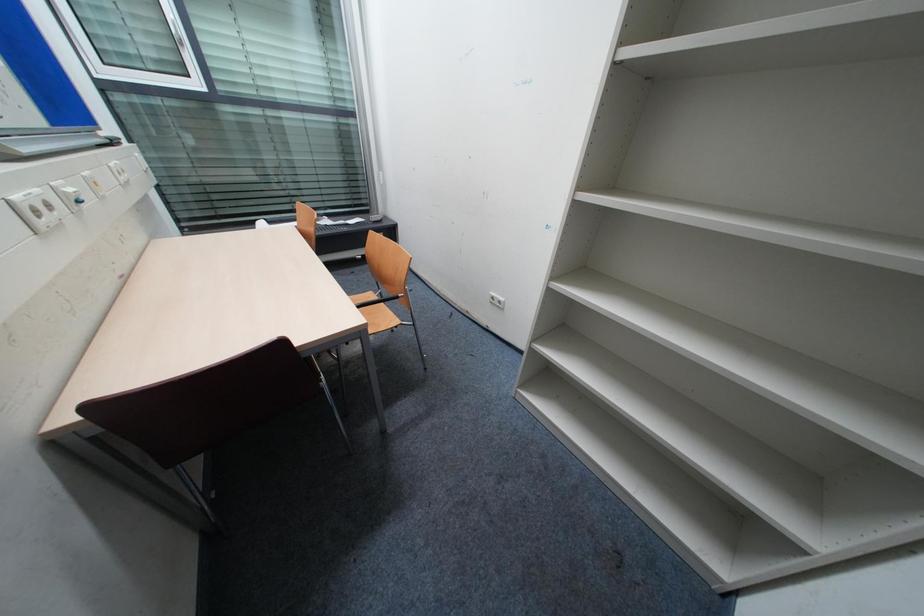
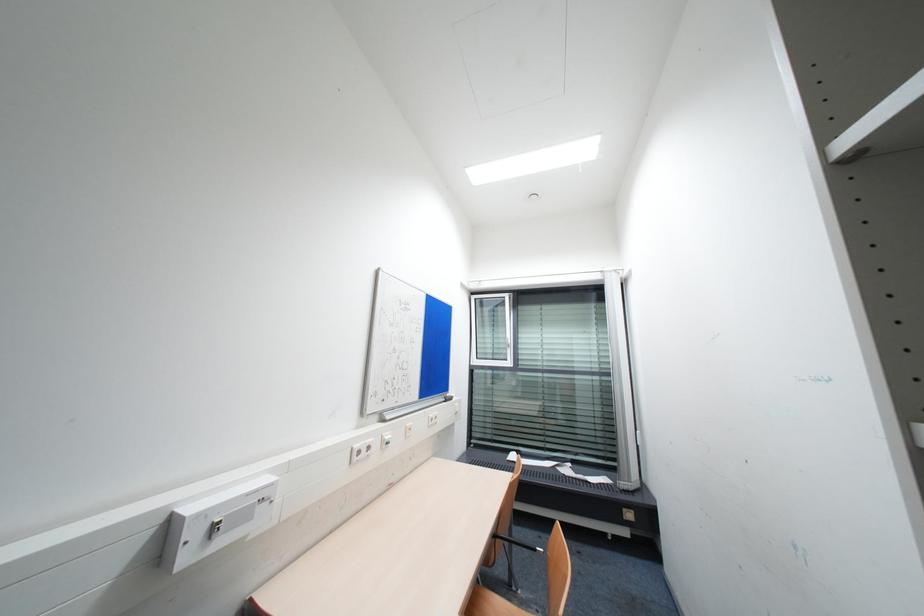
Based on the continuous images, in which direction is the camera rotating?

The camera's rotation is toward left-up.